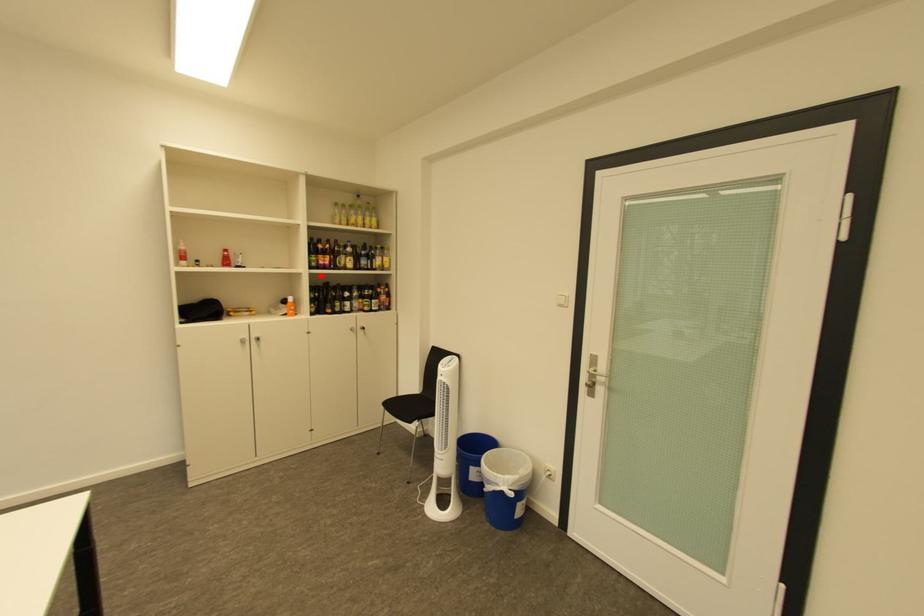
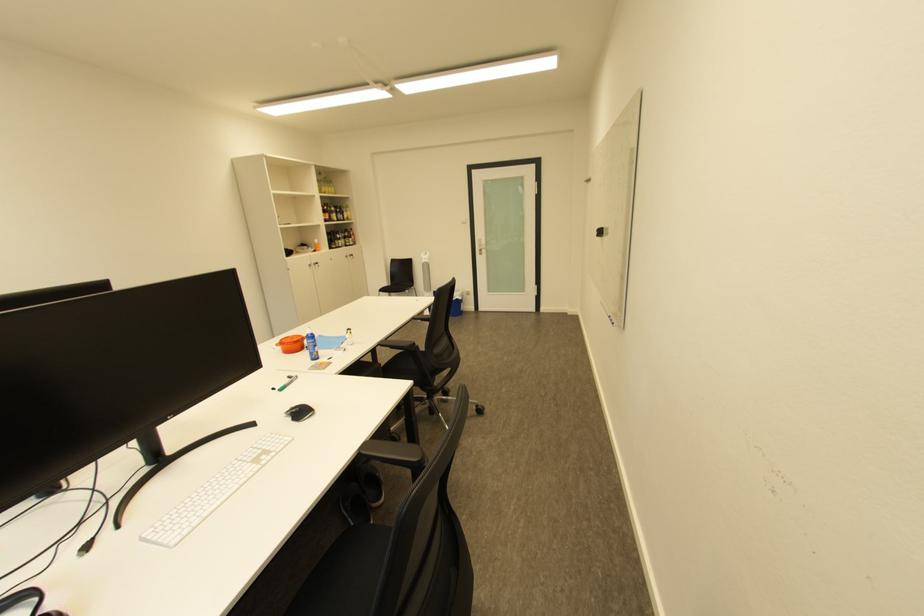
Question: I am providing you with two images of the same scene from different viewpoints. A red point is marked on the first image. At the location where the point appears in image 1, is it still visible in image 2?

Choices:
 (A) Yes
 (B) No

Answer: (A)